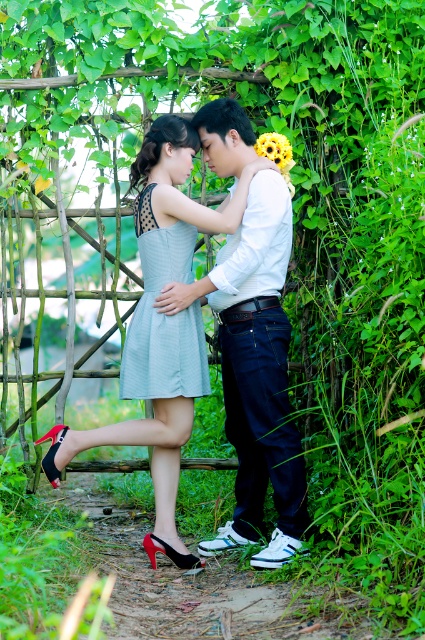
Question: Is matte gray dress at center above yellow matte flower at upper center?

Choices:
 (A) yes
 (B) no

Answer: (B)

Question: Can you confirm if light blue fabric dress at center is positioned to the right of yellow matte flower at upper center?

Choices:
 (A) no
 (B) yes

Answer: (A)

Question: Does white smooth shirt at center appear under light blue fabric dress at center?

Choices:
 (A) no
 (B) yes

Answer: (B)

Question: Which object is the farthest from the matte gray dress at center?

Choices:
 (A) yellow matte flower at upper center
 (B) white smooth shirt at center

Answer: (A)

Question: Which object appears farthest from the camera in this image?

Choices:
 (A) matte gray dress at center
 (B) light blue fabric dress at center
 (C) yellow matte flower at upper center

Answer: (C)

Question: Which object is closer to the camera taking this photo?

Choices:
 (A) white smooth shirt at center
 (B) matte gray dress at center
 (C) yellow matte flower at upper center
 (D) light blue fabric dress at center

Answer: (A)